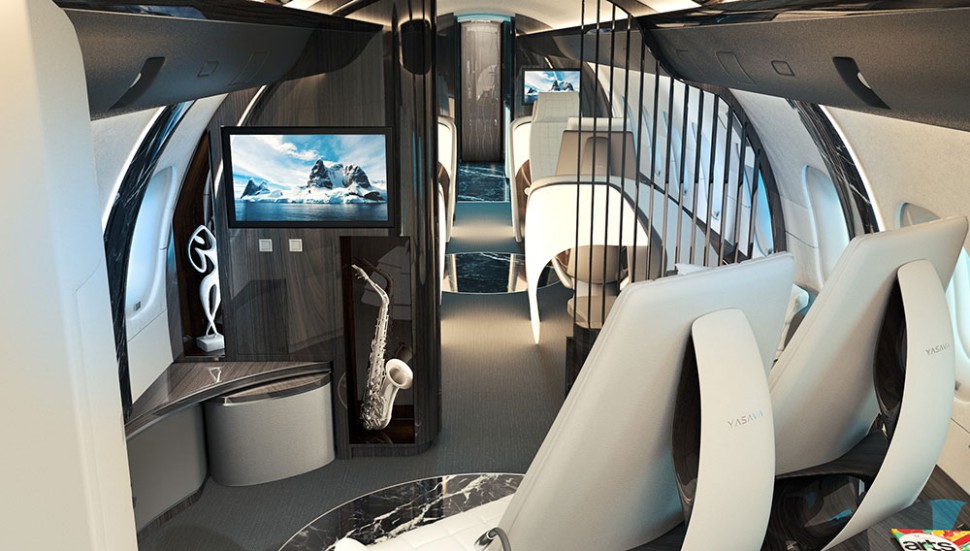
Where is `magazine`? The width and height of the screenshot is (970, 551). magazine is located at coordinates (942, 537).